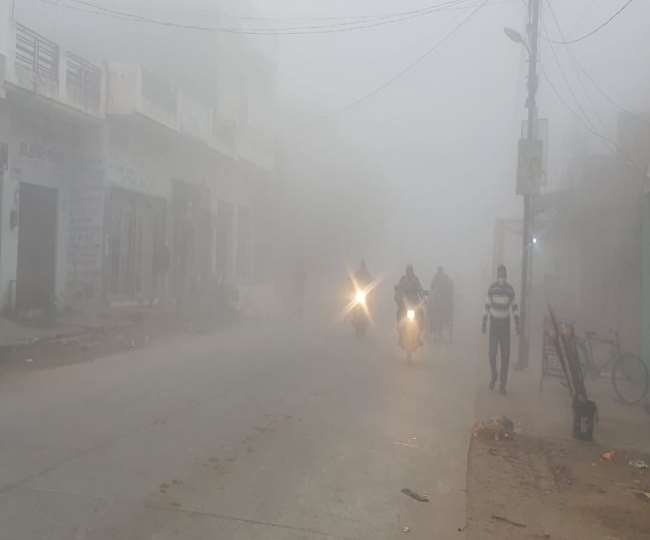
This screenshot has width=650, height=540. I want to click on wires, so click(x=403, y=78), click(x=385, y=24), click(x=398, y=16), click(x=578, y=40), click(x=551, y=94), click(x=574, y=97), click(x=578, y=76), click(x=588, y=77).